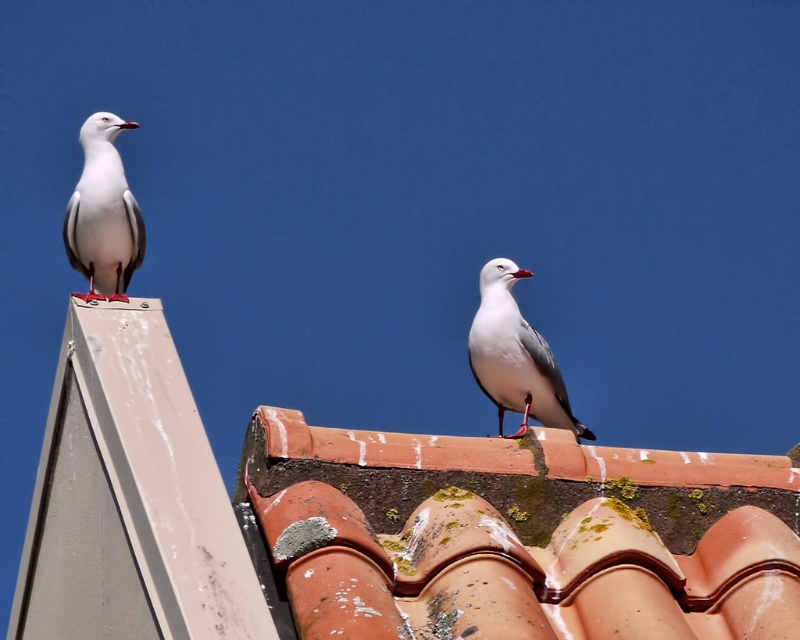
You are a photographer trying to capture both the terracotta tiles at upper center and the white matte bird at upper left in a single shot. Based on their sizes in the image, which object should you focus on first to ensure both are in frame?

The terracotta tiles at upper center occupies less space than white matte bird at upper left, so you should focus on the white matte bird at upper left first as it takes up more space in the frame, ensuring both fit within the shot.

In the scene shown: You are a birdwatcher observing the two birds on the roof. Which bird is positioned lower on the roof edge between the white feathered bird at upper right and the white matte bird at upper left?

The white feathered bird at upper right is positioned lower on the roof edge compared to the white matte bird at upper left according to their spatial arrangement.

You are a photographer trying to capture both the terracotta tiles at upper center and the white feathered bird at upper right in a single shot. Based on their sizes in the image, which object would appear bigger in your photo?

The terracotta tiles at upper center would appear bigger in the photo because their width is larger than that of the white feathered bird at upper right.